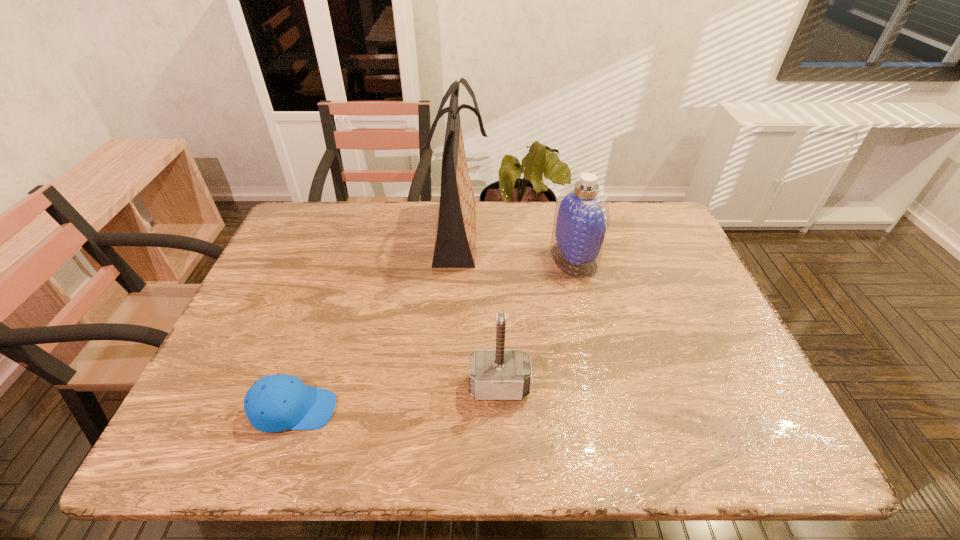
Where is `the tallest object`? The image size is (960, 540). the tallest object is located at coordinates (454, 247).

This screenshot has height=540, width=960. Find the location of `the rightmost object`. the rightmost object is located at coordinates (582, 216).

Where is `hammer`? Image resolution: width=960 pixels, height=540 pixels. hammer is located at coordinates (494, 374).

Where is `the leftmost object`? Image resolution: width=960 pixels, height=540 pixels. the leftmost object is located at coordinates (274, 403).

Locate an element on the screen. The height and width of the screenshot is (540, 960). the shortest object is located at coordinates (274, 403).

You are a GUI agent. You are given a task and a screenshot of the screen. Output one action in this format:
    pyautogui.click(x=<x>, y=<y>)
    Task: Click on the vacant space situated 0.160m on the front-facing side of the shopping bag
    
    Given the screenshot: What is the action you would take?
    pyautogui.click(x=540, y=233)

At what (x,y) coordinates should I click in order to perform the action: click on blank area located on the left of the cleansing agent. Please return your answer as a coordinate pair (x, y). This screenshot has height=540, width=960. Looking at the image, I should click on (480, 259).

You are a GUI agent. You are given a task and a screenshot of the screen. Output one action in this format:
    pyautogui.click(x=<x>, y=<y>)
    Task: Click on the blank space located for striking with the head of the hammer
    
    Given the screenshot: What is the action you would take?
    pyautogui.click(x=501, y=439)

At what (x,y) coordinates should I click in order to perform the action: click on free location located 0.260m on the front-facing side of the leftmost object. Please return your answer as a coordinate pair (x, y). The image size is (960, 540). Looking at the image, I should click on (462, 409).

Locate an element on the screen. This screenshot has height=540, width=960. shopping bag that is positioned at the far edge is located at coordinates (454, 247).